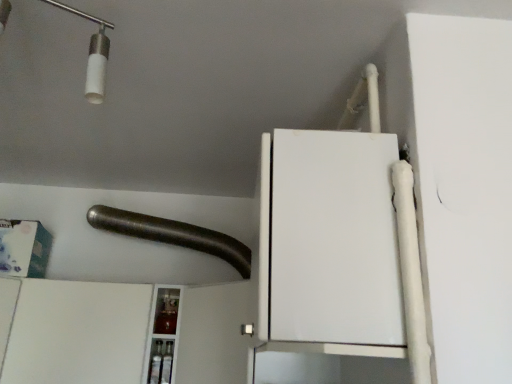
Question: From their relative heights in the image, would you say white matte cabinet at lower left is taller or shorter than brushed metal pipe at upper center?

Choices:
 (A) tall
 (B) short

Answer: (A)

Question: Is white matte cabinet at lower left situated inside brushed metal pipe at upper center or outside?

Choices:
 (A) inside
 (B) outside

Answer: (B)

Question: Considering the positions of white matte cabinet at lower left and brushed metal pipe at upper center in the image, is white matte cabinet at lower left bigger or smaller than brushed metal pipe at upper center?

Choices:
 (A) big
 (B) small

Answer: (A)

Question: From a real-world perspective, relative to white matte cabinet at lower left, is brushed metal pipe at upper center vertically above or below?

Choices:
 (A) above
 (B) below

Answer: (A)

Question: Which is correct: brushed metal pipe at upper center is inside white matte cabinet at lower left, or outside of it?

Choices:
 (A) outside
 (B) inside

Answer: (A)

Question: In the image, is brushed metal pipe at upper center positioned in front of or behind white matte cabinet at lower left?

Choices:
 (A) front
 (B) behind

Answer: (B)

Question: Considering the positions of brushed metal pipe at upper center and white matte cabinet at lower left in the image, is brushed metal pipe at upper center bigger or smaller than white matte cabinet at lower left?

Choices:
 (A) big
 (B) small

Answer: (B)